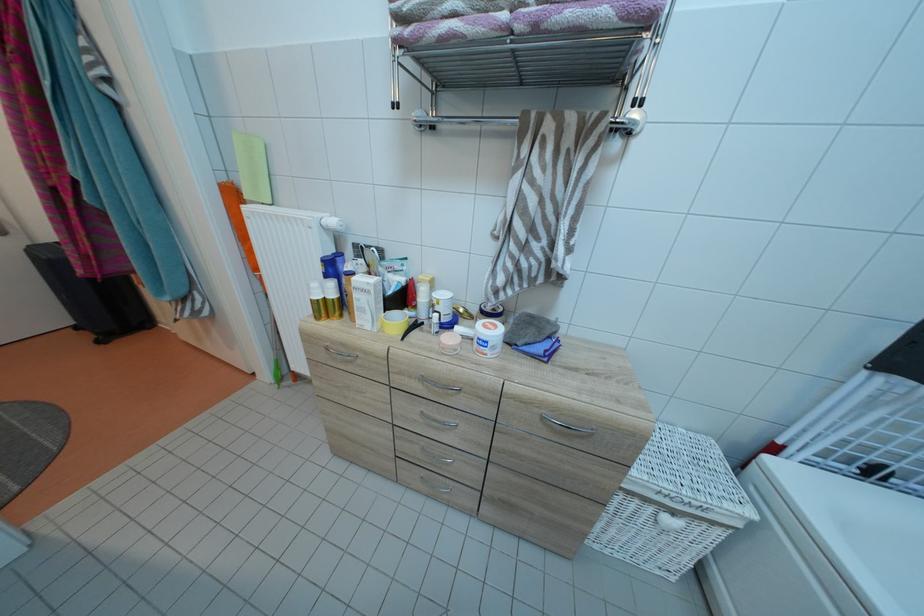
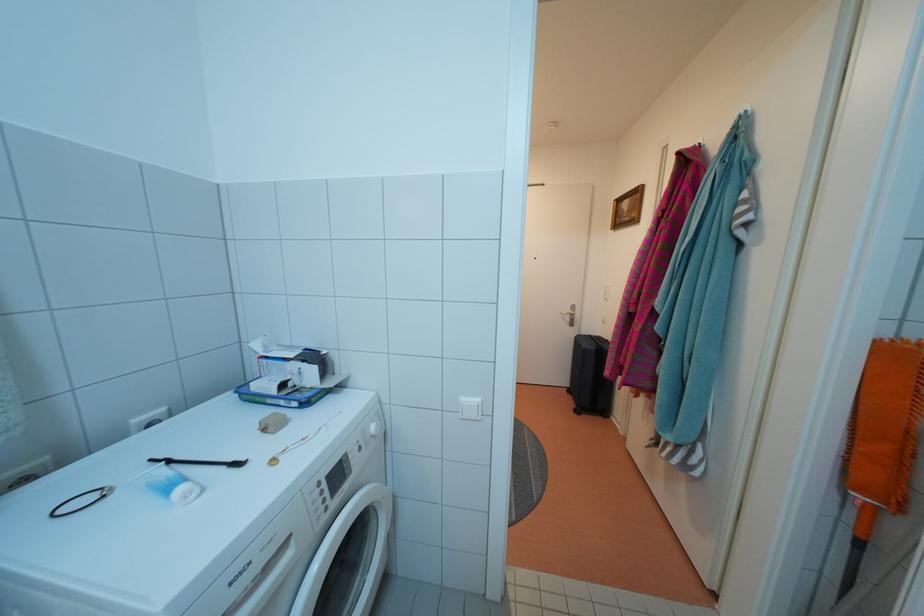
Question: The first image is from the beginning of the video and the second image is from the end. How did the camera likely rotate when shooting the video?

Choices:
 (A) Left
 (B) Right
 (C) Up
 (D) Down

Answer: (A)